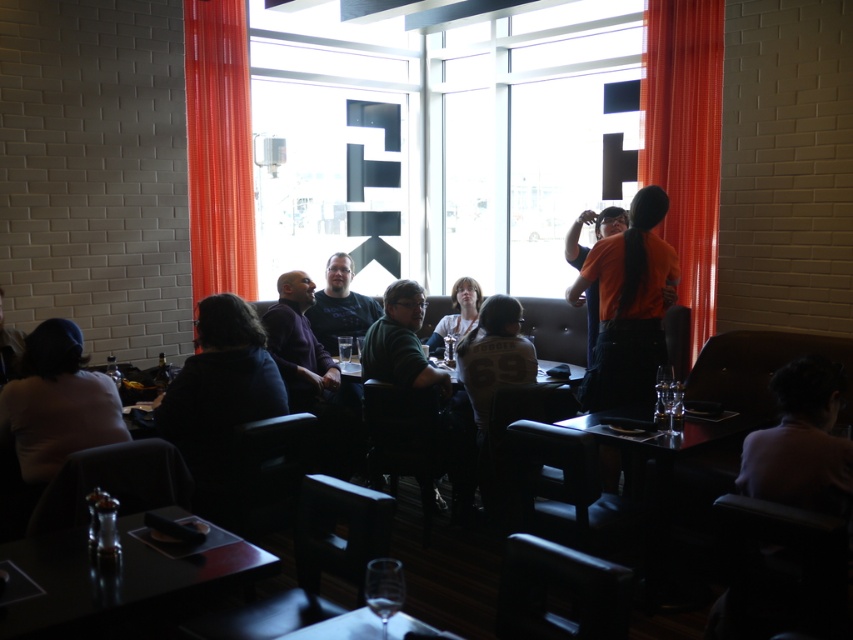
You are a customer sitting at a table in the center of the restaurant. You notice a transparent glass window at center and a white jersey at center. Which object is taller when viewed from your seat?

The transparent glass window at center is taller than the white jersey at center.

You are a photographer standing in the restaurant and want to take a photo that includes both the point at (532, 273) and the point at (500, 308). Which point should you focus on to ensure both are in sharp focus?

You should focus on the point at (532, 273) because it is further away from the camera than the point at (500, 308). By focusing on the farther point, the depth of field will include the closer point as well, ensuring both are in sharp focus.

You are a customer sitting at a table in the center of the room. You notice a transparent glass window at center and a white jersey at center. Which object is above the other?

The transparent glass window at center is positioned over the white jersey at center, meaning the window is above the jersey.